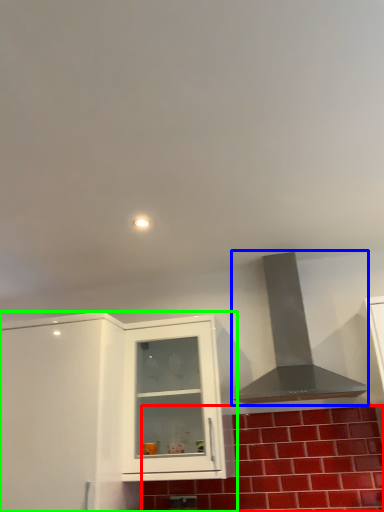
Question: Considering the real-world distances, which object is farthest from brick (highlighted by a red box)? vent (highlighted by a blue box) or cabinetry (highlighted by a green box)?

Choices:
 (A) vent
 (B) cabinetry

Answer: (B)